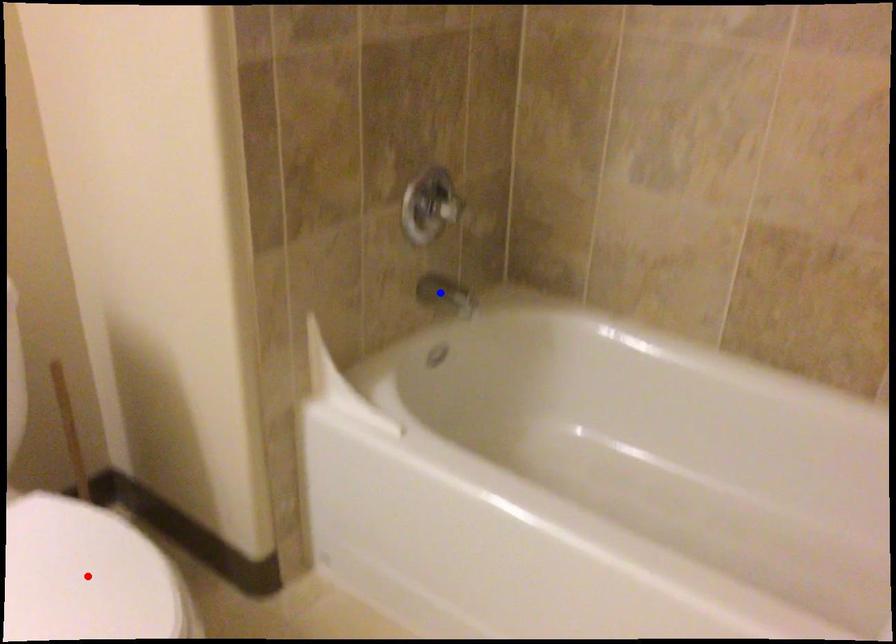
Question: Two points are marked on the image. Which point is closer to the camera?

Choices:
 (A) Blue point is closer.
 (B) Red point is closer.

Answer: (B)